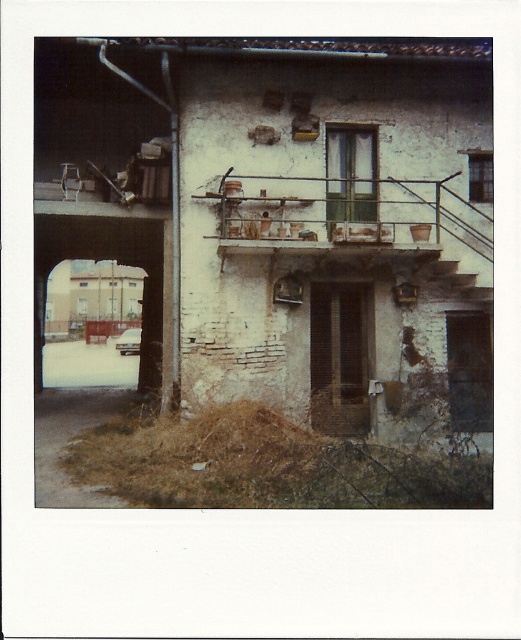
Question: Which of the following is the closest to the observer?

Choices:
 (A) (456, 198)
 (B) (481, 278)

Answer: (B)

Question: Is rustic wooden balcony at center below wooden staircase at center?

Choices:
 (A) yes
 (B) no

Answer: (B)

Question: Which object is farther from the camera taking this photo?

Choices:
 (A) rustic wooden balcony at center
 (B) wooden staircase at center

Answer: (B)

Question: Does rustic wooden balcony at center appear over wooden staircase at center?

Choices:
 (A) no
 (B) yes

Answer: (B)

Question: Is rustic wooden balcony at center positioned behind wooden staircase at center?

Choices:
 (A) no
 (B) yes

Answer: (A)